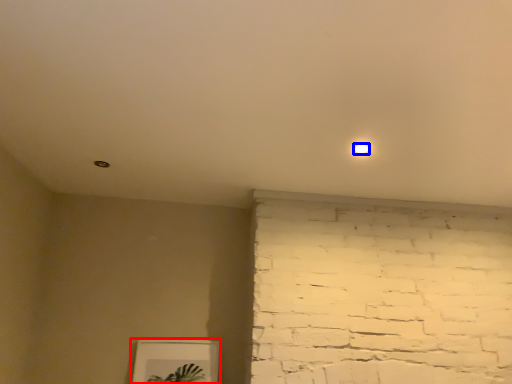
Question: Among these objects, which one is nearest to the camera, picture frame (highlighted by a red box) or light (highlighted by a blue box)?

Choices:
 (A) picture frame
 (B) light

Answer: (B)